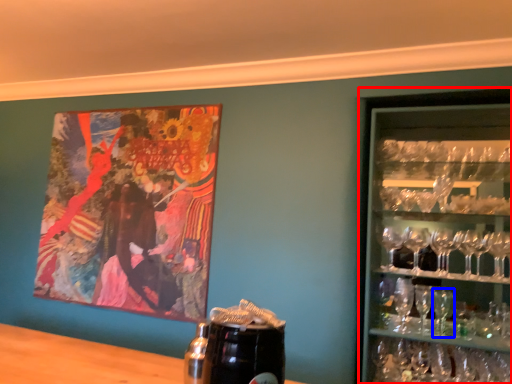
Question: Which object appears farthest to the camera in this image, shelf (highlighted by a red box) or martini glass (highlighted by a blue box)?

Choices:
 (A) shelf
 (B) martini glass

Answer: (B)